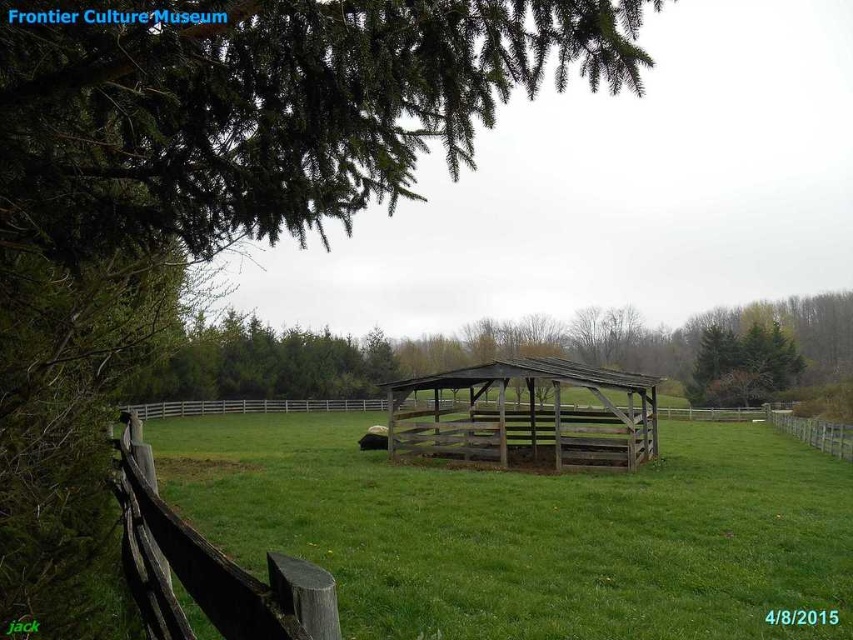
Question: Which point is farther from the camera taking this photo?

Choices:
 (A) pyautogui.click(x=757, y=468)
 (B) pyautogui.click(x=822, y=440)

Answer: (B)

Question: Which of the following is the closest to the observer?

Choices:
 (A) (825, 445)
 (B) (705, 337)

Answer: (A)

Question: Among these points, which one is nearest to the camera?

Choices:
 (A) (778, 371)
 (B) (608, 378)

Answer: (B)

Question: Is green grassy field at center to the right of green wood tree at center from the viewer's perspective?

Choices:
 (A) yes
 (B) no

Answer: (B)

Question: Is green grassy field at center further to camera compared to brown wooden fence at center?

Choices:
 (A) no
 (B) yes

Answer: (A)

Question: Does green wood tree at center appear on the left side of green leafy tree at upper right?

Choices:
 (A) no
 (B) yes

Answer: (B)